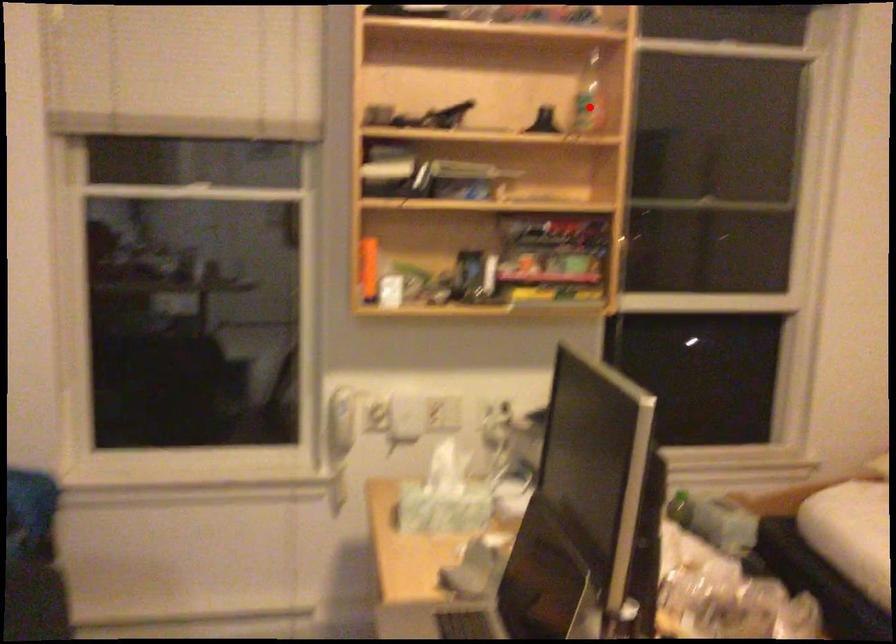
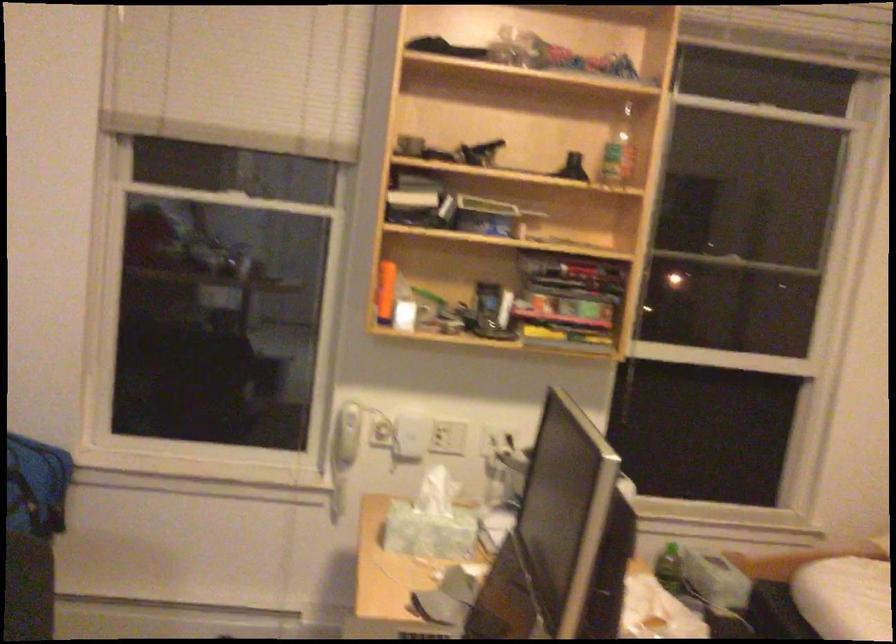
Where in the second image is the point corresponding to the highlighted location from the first image?

(617, 151)